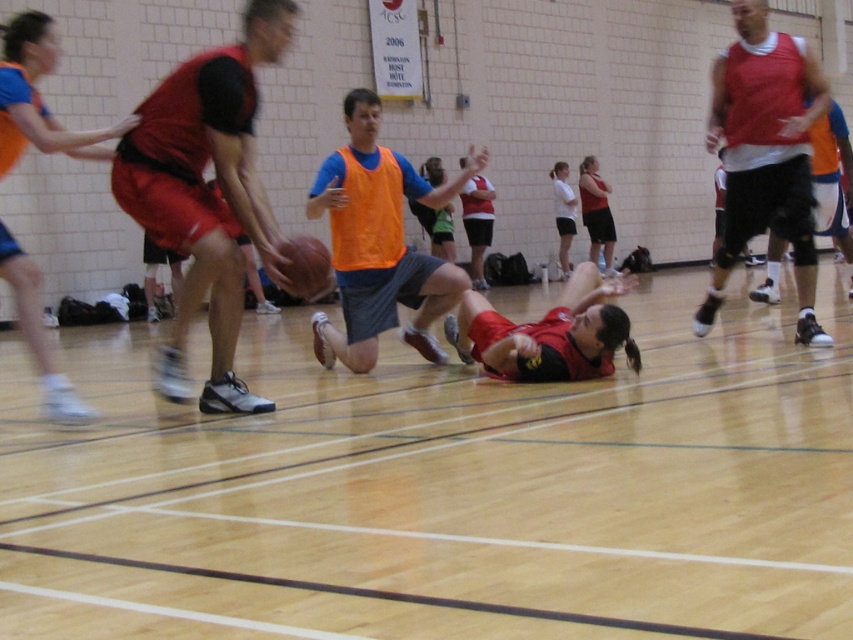
Identify the location of matte black shorts at center. (575, 109).

Is point (631, 83) behind point (735, 154)?

That is True.

Between point (640, 129) and point (757, 90), which one is positioned in front?

Positioned in front is point (757, 90).

Find the location of a particular element. matte black shorts at center is located at coordinates (575, 109).

Is matte red shorts at left to the right of matte red shorts at center from the viewer's perspective?

No, matte red shorts at left is not to the right of matte red shorts at center.

Which of these two, matte red shorts at left or matte red shorts at center, stands taller?

matte red shorts at left is taller.

What do you see at coordinates (206, 193) in the screenshot?
I see `matte red shorts at left` at bounding box center [206, 193].

Where is `matte red shorts at left`? matte red shorts at left is located at coordinates (206, 193).

Between point (741, 317) and point (251, 221), which one is positioned in front?

Point (251, 221) is more forward.

Is point (177, 493) less distant than point (149, 232)?

Yes, it is.

Find the location of a particular element. wooden floor at center is located at coordinates (444, 490).